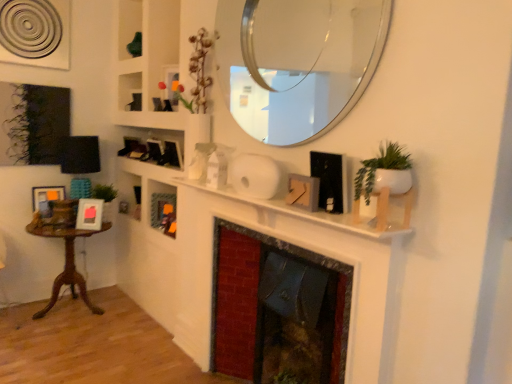
Question: Is white matte fireplace at center at the left side of matte wooden picture frame at left, acting as the first picture frame starting from the left?

Choices:
 (A) no
 (B) yes

Answer: (A)

Question: From the image's perspective, does white matte fireplace at center appear lower than matte wooden picture frame at left, acting as the 3th picture frame starting from the front?

Choices:
 (A) yes
 (B) no

Answer: (A)

Question: Can matte wooden picture frame at left, which appears as the first picture frame when viewed from the back, be found inside white matte fireplace at center?

Choices:
 (A) yes
 (B) no

Answer: (B)

Question: From a real-world perspective, is white matte fireplace at center physically below matte wooden picture frame at left, which appears as the first picture frame when viewed from the back?

Choices:
 (A) no
 (B) yes

Answer: (A)

Question: Is white matte fireplace at center with matte wooden picture frame at left, marked as the 3th picture frame in a right-to-left arrangement?

Choices:
 (A) no
 (B) yes

Answer: (A)

Question: Is point (392, 188) positioned closer to the camera than point (257, 31)?

Choices:
 (A) farther
 (B) closer

Answer: (B)

Question: From the image's perspective, relative to clear glass mirror at upper center, is white matte plant pot at upper right above or below?

Choices:
 (A) below
 (B) above

Answer: (A)

Question: Choose the correct answer: Is white matte plant pot at upper right inside clear glass mirror at upper center or outside it?

Choices:
 (A) inside
 (B) outside

Answer: (B)

Question: From a real-world perspective, is white matte plant pot at upper right positioned above or below clear glass mirror at upper center?

Choices:
 (A) below
 (B) above

Answer: (A)

Question: Is matte wooden picture frame at left, marked as the 3th picture frame in a right-to-left arrangement, to the left or to the right of white matte plant pot at upper right in the image?

Choices:
 (A) left
 (B) right

Answer: (A)

Question: From the image's perspective, is matte wooden picture frame at left, which appears as the first picture frame when viewed from the back, positioned above or below white matte plant pot at upper right?

Choices:
 (A) below
 (B) above

Answer: (A)

Question: Relative to white matte plant pot at upper right, is matte wooden picture frame at left, acting as the first picture frame starting from the left, in front or behind?

Choices:
 (A) front
 (B) behind

Answer: (B)

Question: From a real-world perspective, relative to white matte plant pot at upper right, is matte wooden picture frame at left, marked as the 3th picture frame in a right-to-left arrangement, vertically above or below?

Choices:
 (A) above
 (B) below

Answer: (B)

Question: From their relative heights in the image, would you say white matte fireplace at center is taller or shorter than wooden table at left?

Choices:
 (A) tall
 (B) short

Answer: (B)

Question: Is white matte fireplace at center spatially inside wooden table at left, or outside of it?

Choices:
 (A) inside
 (B) outside

Answer: (B)